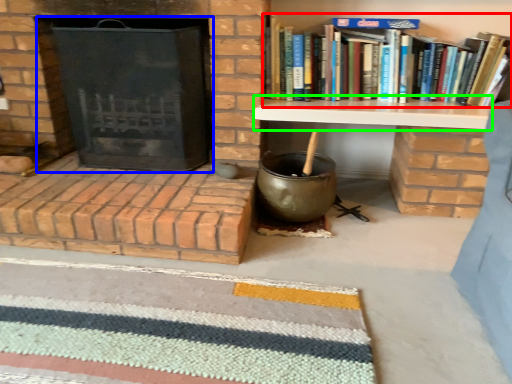
Question: Which object is positioned closest to book (highlighted by a red box)? Select from fireplace (highlighted by a blue box) and table (highlighted by a green box).

Choices:
 (A) fireplace
 (B) table

Answer: (B)